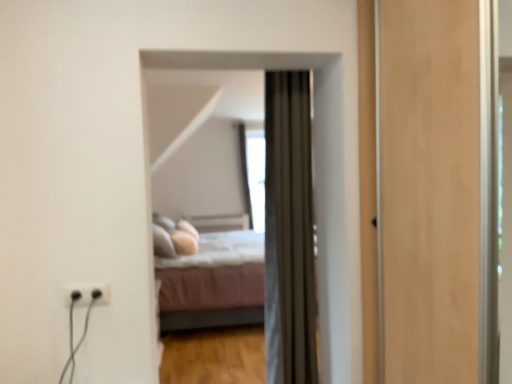
Question: Is black plastic outlet at lower left far away from velvet brown curtain at center?

Choices:
 (A) yes
 (B) no

Answer: (B)

Question: From a real-world perspective, is black plastic outlet at lower left below velvet brown curtain at center?

Choices:
 (A) yes
 (B) no

Answer: (A)

Question: Is black plastic outlet at lower left in front of velvet brown curtain at center?

Choices:
 (A) no
 (B) yes

Answer: (B)

Question: Does black plastic outlet at lower left have a larger size compared to velvet brown curtain at center?

Choices:
 (A) yes
 (B) no

Answer: (B)

Question: Is black plastic outlet at lower left oriented away from velvet brown curtain at center?

Choices:
 (A) no
 (B) yes

Answer: (A)

Question: From a real-world perspective, is velvet brown curtain at center above or below light pink fabric bed at center?

Choices:
 (A) below
 (B) above

Answer: (B)

Question: From the image's perspective, is velvet brown curtain at center located above or below light pink fabric bed at center?

Choices:
 (A) above
 (B) below

Answer: (A)

Question: Is velvet brown curtain at center taller or shorter than light pink fabric bed at center?

Choices:
 (A) short
 (B) tall

Answer: (B)

Question: Visually, is velvet brown curtain at center positioned to the left or to the right of light pink fabric bed at center?

Choices:
 (A) left
 (B) right

Answer: (B)

Question: Is point (261, 139) positioned closer to the camera than point (239, 281)?

Choices:
 (A) closer
 (B) farther

Answer: (B)

Question: From the image's perspective, is transparent glass window at center above or below light pink fabric bed at center?

Choices:
 (A) above
 (B) below

Answer: (A)

Question: Considering their positions, is transparent glass window at center located in front of or behind light pink fabric bed at center?

Choices:
 (A) front
 (B) behind

Answer: (B)

Question: In terms of width, does transparent glass window at center look wider or thinner when compared to light pink fabric bed at center?

Choices:
 (A) thin
 (B) wide

Answer: (A)

Question: From the image's perspective, relative to black plastic outlet at lower left, is transparent glass window at center above or below?

Choices:
 (A) above
 (B) below

Answer: (A)

Question: In the image, is transparent glass window at center on the left side or the right side of black plastic outlet at lower left?

Choices:
 (A) left
 (B) right

Answer: (B)